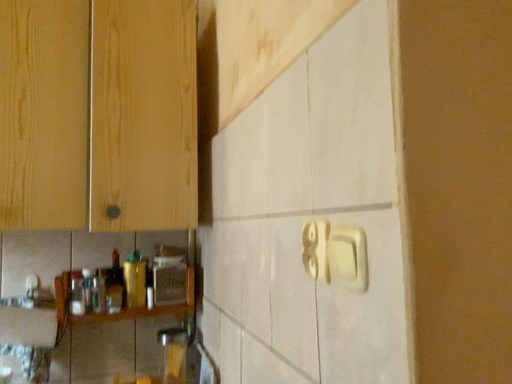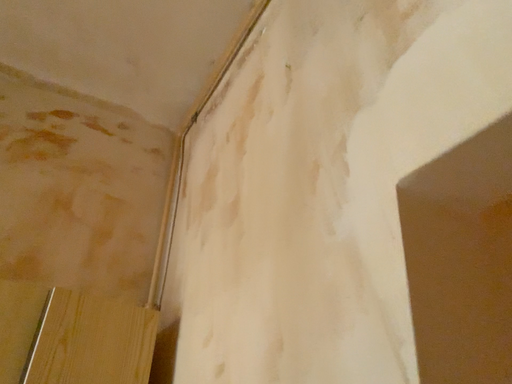
Question: Which way did the camera rotate in the video?

Choices:
 (A) rotated right
 (B) rotated left

Answer: (A)